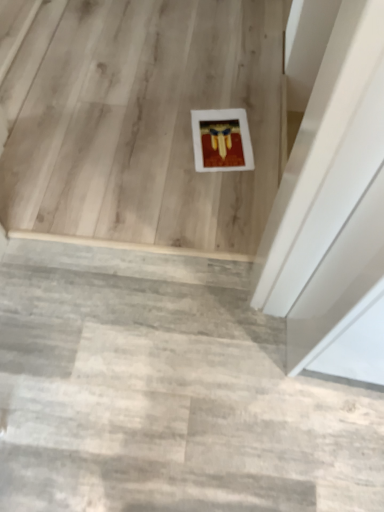
Locate an element on the screen. The image size is (384, 512). free space above concrete textured stairs at center, the second stairwell viewed from the back (from a real-world perspective) is located at coordinates (156, 379).